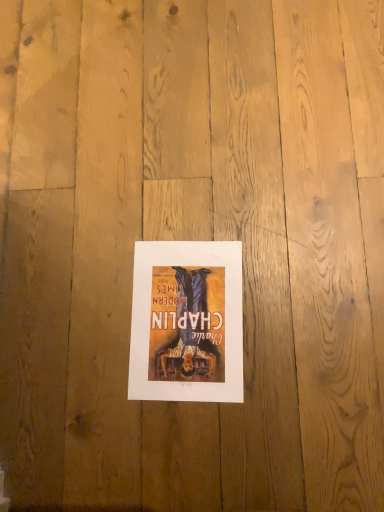
You are a GUI agent. You are given a task and a screenshot of the screen. Output one action in this format:
    pyautogui.click(x=<x>, y=<y>)
    Task: Click on the matte paper poster at center
    Image resolution: width=384 pixels, height=512 pixels.
    Given the screenshot: What is the action you would take?
    pyautogui.click(x=187, y=322)

Consider the image. In order to face matte paper poster at center, should I rotate leftwards or rightwards?

Rotate left and turn 0.548 degrees.

The height and width of the screenshot is (512, 384). Describe the element at coordinates (187, 322) in the screenshot. I see `matte paper poster at center` at that location.

What are the coordinates of `matte paper poster at center` in the screenshot? It's located at (187, 322).